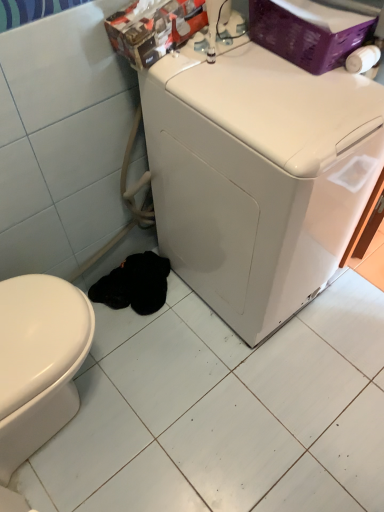
Question: Does white glossy washing machine at center turn towards white glossy ceramic tile at lower center?

Choices:
 (A) yes
 (B) no

Answer: (B)

Question: Is white glossy washing machine at center behind white glossy ceramic tile at lower center?

Choices:
 (A) no
 (B) yes

Answer: (A)

Question: Is white glossy washing machine at center at the left side of white glossy ceramic tile at lower center?

Choices:
 (A) no
 (B) yes

Answer: (A)

Question: From the image's perspective, is white glossy washing machine at center below white glossy ceramic tile at lower center?

Choices:
 (A) no
 (B) yes

Answer: (A)

Question: Does white glossy washing machine at center have a smaller size compared to white glossy ceramic tile at lower center?

Choices:
 (A) yes
 (B) no

Answer: (B)

Question: Can you confirm if white glossy washing machine at center is positioned to the right of white glossy ceramic tile at lower center?

Choices:
 (A) no
 (B) yes

Answer: (B)

Question: From the image's perspective, is white glossy ceramic tile at lower center located above white glossy washing machine at center?

Choices:
 (A) no
 (B) yes

Answer: (A)

Question: Is white glossy ceramic tile at lower center outside of white glossy washing machine at center?

Choices:
 (A) no
 (B) yes

Answer: (B)

Question: Is white glossy ceramic tile at lower center aimed at white glossy washing machine at center?

Choices:
 (A) yes
 (B) no

Answer: (B)

Question: Can you confirm if white glossy ceramic tile at lower center is bigger than white glossy washing machine at center?

Choices:
 (A) yes
 (B) no

Answer: (B)

Question: Is white glossy ceramic tile at lower center beside white glossy washing machine at center?

Choices:
 (A) no
 (B) yes

Answer: (A)

Question: Is white glossy ceramic tile at lower center to the left of white glossy washing machine at center from the viewer's perspective?

Choices:
 (A) no
 (B) yes

Answer: (B)

Question: Is white glossy washing machine at center situated inside white glossy ceramic tile at lower center or outside?

Choices:
 (A) outside
 (B) inside

Answer: (A)